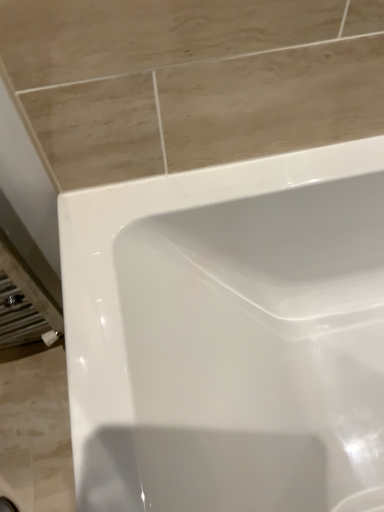
Find the location of a particular element. The width and height of the screenshot is (384, 512). white glossy sink at upper center is located at coordinates (229, 335).

Describe the element at coordinates (229, 335) in the screenshot. I see `white glossy sink at upper center` at that location.

Identify the location of white glossy sink at upper center. (229, 335).